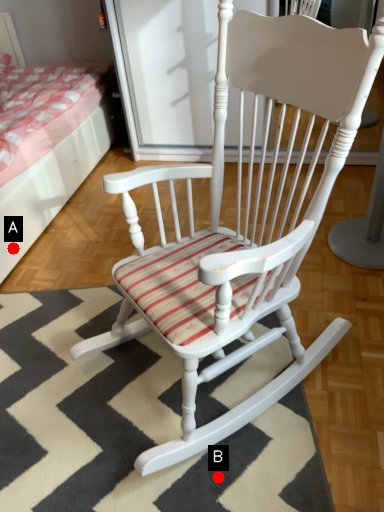
Question: Two points are circled on the image, labeled by A and B beside each circle. Among these points, which one is nearest to the camera?

Choices:
 (A) A is closer
 (B) B is closer

Answer: (B)